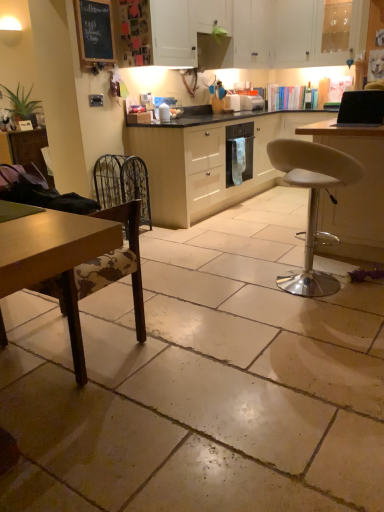
Identify the location of vacant space underneath wooden chair at lower left, placed as the second chair when sorted from right to left (from a real-world perspective). (66, 343).